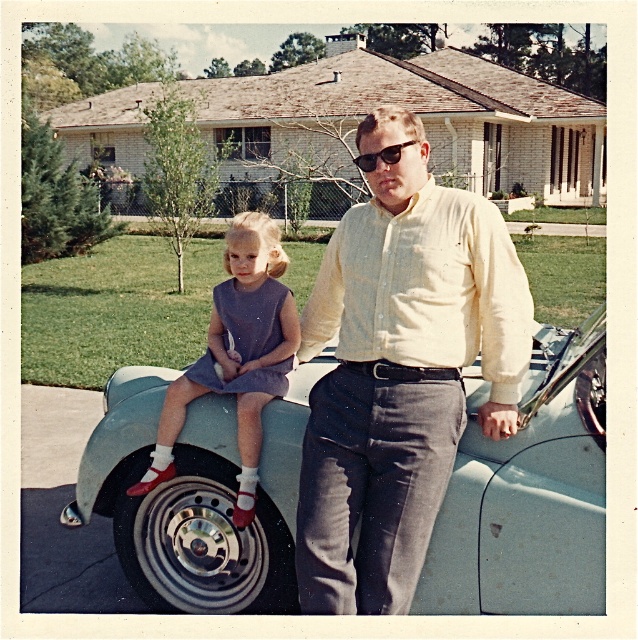
Does light blue car at center have a greater height compared to metallic silver rim at lower left?

Yes, light blue car at center is taller than metallic silver rim at lower left.

How distant is light blue car at center from metallic silver rim at lower left?

light blue car at center is 2.02 inches away from metallic silver rim at lower left.

Is point (537, 508) positioned behind point (276, 604)?

No, it is in front of (276, 604).

This screenshot has height=640, width=638. Identify the location of light blue car at center. (528, 492).

Which is above, light yellow button-down shirt at center or metallic silver rim at lower left?

light yellow button-down shirt at center is above.

What do you see at coordinates (399, 371) in the screenshot? I see `light yellow button-down shirt at center` at bounding box center [399, 371].

I want to click on light yellow button-down shirt at center, so click(399, 371).

Is light blue car at center below matte purple dress at center?

Yes.

Who is more distant from viewer, (477,568) or (189,376)?

Point (189,376)

This screenshot has width=638, height=640. I want to click on light blue car at center, so click(528, 492).